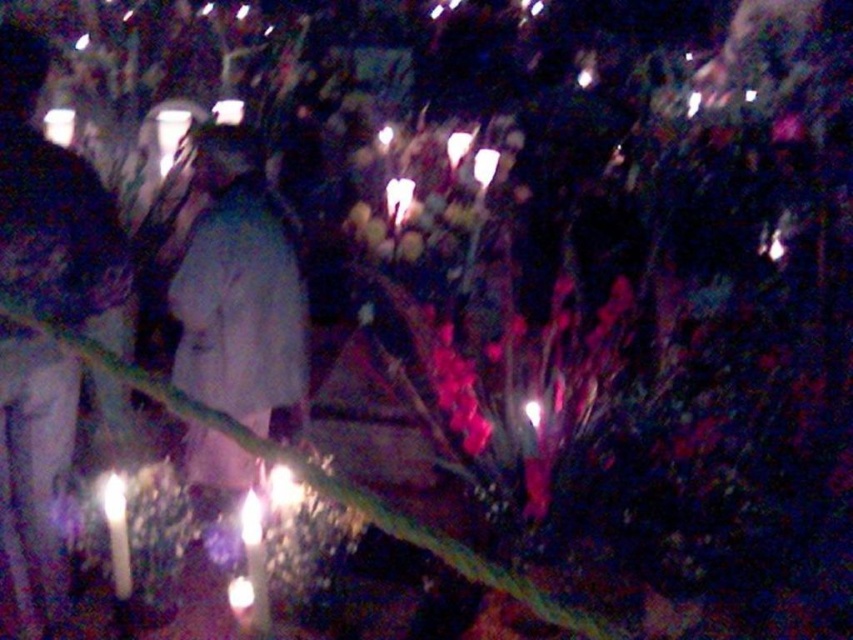
Question: Which of these objects is positioned farthest from the white paper at center?

Choices:
 (A) white matte coat at center
 (B) light gray fabric jacket at left

Answer: (B)

Question: Among these objects, which one is farthest from the camera?

Choices:
 (A) white matte coat at center
 (B) light gray fabric jacket at left
 (C) white wax candle at lower left

Answer: (A)

Question: Can you confirm if white matte coat at center is smaller than white paper at center?

Choices:
 (A) no
 (B) yes

Answer: (A)

Question: Is white matte coat at center positioned at the back of white paper at center?

Choices:
 (A) yes
 (B) no

Answer: (B)

Question: Which point appears closest to the camera in this image?

Choices:
 (A) (93, 170)
 (B) (248, 577)

Answer: (B)

Question: Is translucent glass candle at lower center closer to camera compared to white paper at center?

Choices:
 (A) no
 (B) yes

Answer: (B)